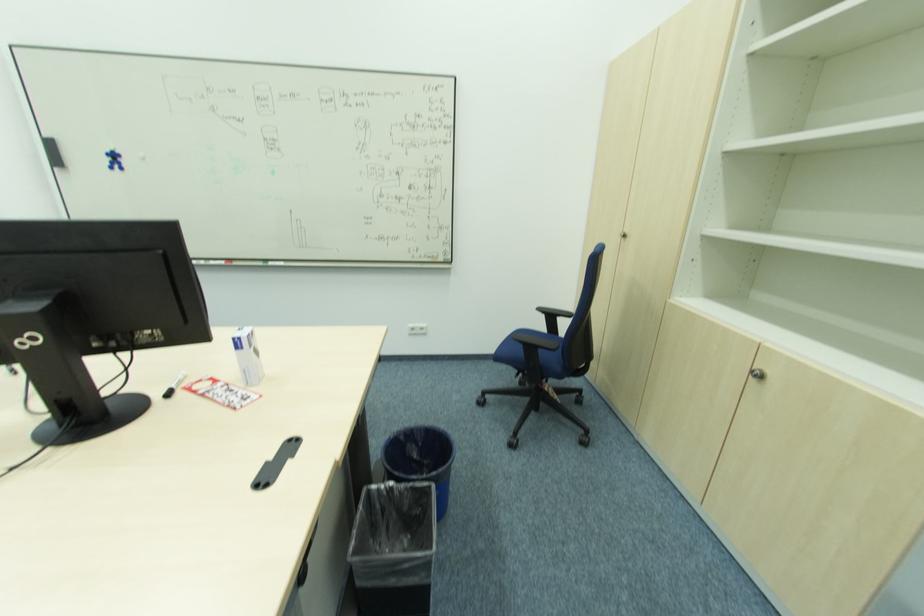
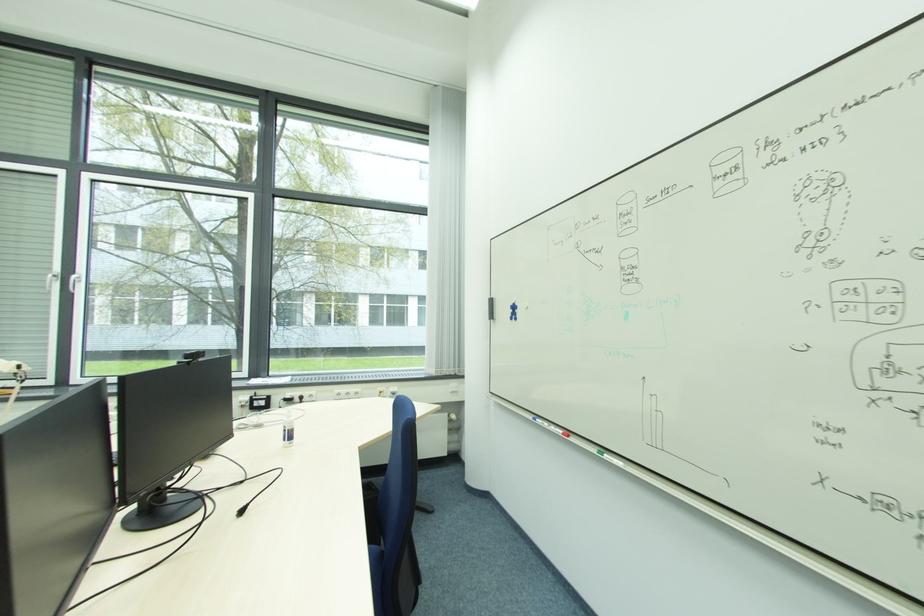
Locate, in the second image, the point that corresponds to (226,265) in the first image.

(563, 434)